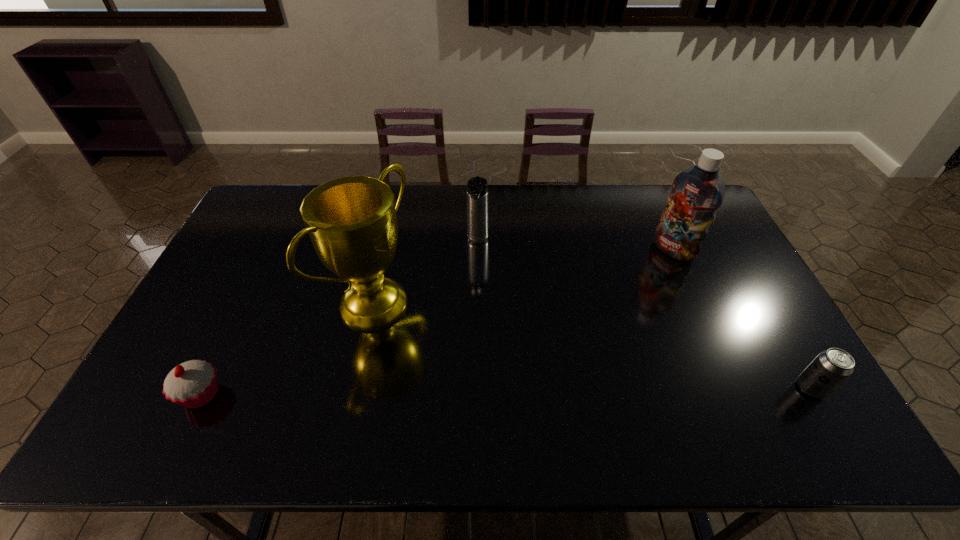
Locate an element on the screen. This screenshot has width=960, height=540. beer can positioned at the right edge is located at coordinates [831, 367].

Locate an element on the screen. This screenshot has width=960, height=540. shampoo positioned at the right edge is located at coordinates (697, 192).

Locate an element on the screen. This screenshot has width=960, height=540. object at the near left corner is located at coordinates (192, 384).

Where is `object situated at the near right corner`? The width and height of the screenshot is (960, 540). object situated at the near right corner is located at coordinates (831, 367).

What are the coordinates of `vacant space at the far edge` in the screenshot? It's located at (637, 198).

This screenshot has height=540, width=960. In the image, there is a desktop. In order to click on vacant space at the near edge in this screenshot , I will do `click(282, 374)`.

You are a GUI agent. You are given a task and a screenshot of the screen. Output one action in this format:
    pyautogui.click(x=<x>, y=<y>)
    Task: Click on the free spot at the left edge of the desktop
    The width and height of the screenshot is (960, 540).
    Given the screenshot: What is the action you would take?
    pyautogui.click(x=186, y=333)

Find the location of a particular element. The width and height of the screenshot is (960, 540). free space at the right edge of the desktop is located at coordinates (724, 294).

Find the location of `free space at the far left corner of the desktop`. free space at the far left corner of the desktop is located at coordinates (280, 217).

Locate an element on the screen. The image size is (960, 540). free spot at the near right corner of the desktop is located at coordinates (749, 392).